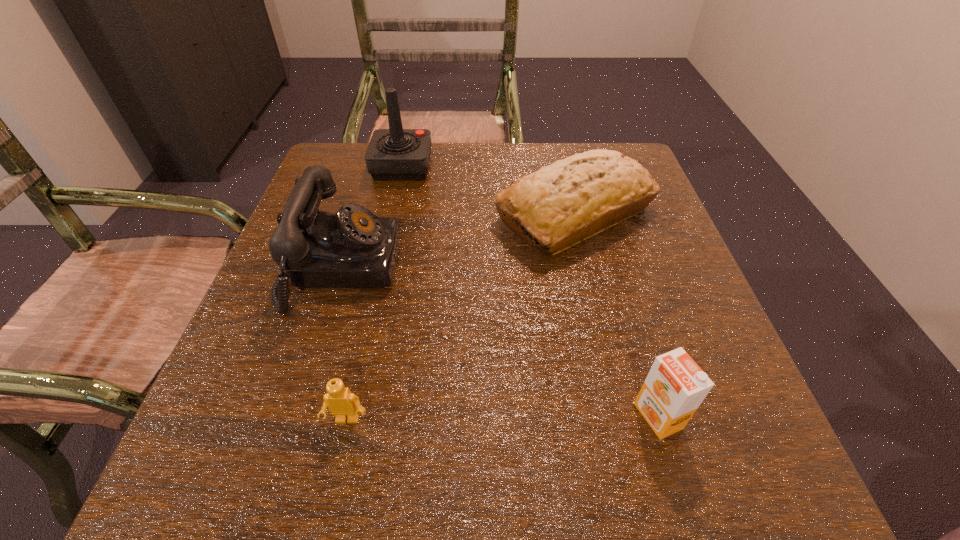
Where is `vacant region between the telephone and the bread`? The image size is (960, 540). vacant region between the telephone and the bread is located at coordinates (458, 240).

I want to click on free spot between the shortest object and the bread, so click(x=461, y=316).

This screenshot has height=540, width=960. In order to click on free space between the orange juice and the bread in this screenshot , I will do `click(616, 314)`.

Locate an element on the screen. The width and height of the screenshot is (960, 540). free point between the joystick and the bread is located at coordinates (489, 190).

Locate an element on the screen. This screenshot has width=960, height=540. vacant space in between the bread and the telephone is located at coordinates (458, 240).

You are a GUI agent. You are given a task and a screenshot of the screen. Output one action in this format:
    pyautogui.click(x=<x>, y=<y>)
    Task: Click on the free space between the bread and the shortest object
    The width and height of the screenshot is (960, 540).
    Given the screenshot: What is the action you would take?
    461,316

Locate an element on the screen. the fourth closest object relative to the shortest object is located at coordinates (393, 154).

Identify the location of the fourth closest object relative to the telephone. The width and height of the screenshot is (960, 540). (675, 386).

Locate an element on the screen. vacant position in the image that satisfies the following two spatial constraints: 1. on the back side of the orange juice; 2. on the front-facing side of the joystick is located at coordinates (584, 166).

You are a GUI agent. You are given a task and a screenshot of the screen. Output one action in this format:
    pyautogui.click(x=<x>, y=<y>)
    Task: Click on the vacant position in the image that satisfies the following two spatial constraints: 1. on the dial of the telephone; 2. on the left side of the orange juice
    This screenshot has width=960, height=540.
    Given the screenshot: What is the action you would take?
    pyautogui.click(x=295, y=416)